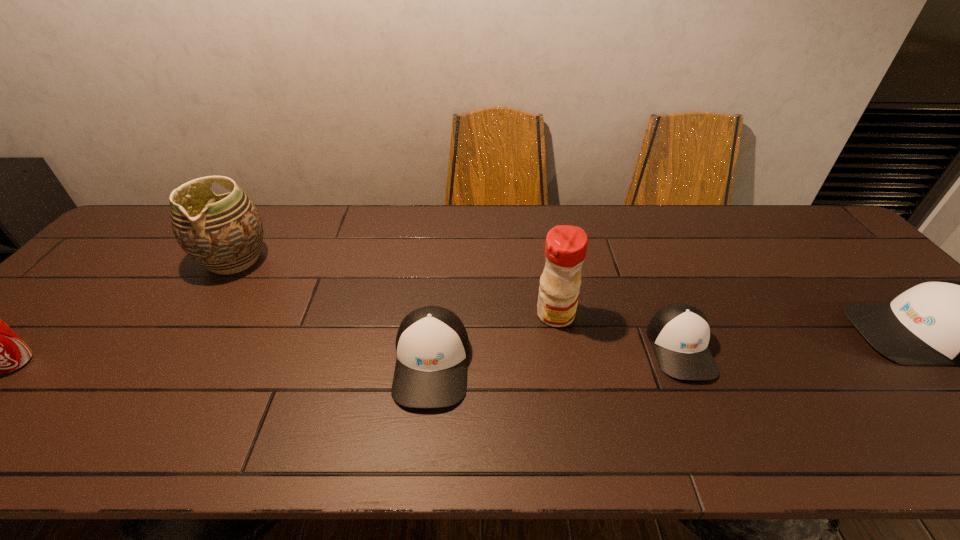
Where is `the fourth object from right to left`? This screenshot has height=540, width=960. the fourth object from right to left is located at coordinates (432, 345).

Where is `the leftmost cap`? The width and height of the screenshot is (960, 540). the leftmost cap is located at coordinates (432, 345).

Locate an element on the screen. This screenshot has height=540, width=960. the fifth object from left to right is located at coordinates (679, 333).

The image size is (960, 540). Find the location of `the shortest object`. the shortest object is located at coordinates (679, 333).

Locate an element on the screen. the farthest object is located at coordinates (223, 233).

The image size is (960, 540). Identify the location of pottery. (223, 233).

You are a GUI agent. You are given a task and a screenshot of the screen. Output one action in this format:
    pyautogui.click(x=<x>, y=<y>)
    Task: Click on the condiment
    The height and width of the screenshot is (540, 960).
    Given the screenshot: What is the action you would take?
    pyautogui.click(x=565, y=249)

You are a GUI agent. You are given a task and a screenshot of the screen. Output one action in this format:
    pyautogui.click(x=<x>, y=<y>)
    Task: Click on the free space located 0.180m on the back of the fifth object from right to left
    The height and width of the screenshot is (540, 960).
    Given the screenshot: What is the action you would take?
    pyautogui.click(x=270, y=206)

Locate an element on the screen. The width and height of the screenshot is (960, 540). free region located on the back of the fourth object from left to right is located at coordinates (540, 226).

You are a GUI agent. You are given a task and a screenshot of the screen. Output one action in this format:
    pyautogui.click(x=<x>, y=<y>)
    Task: Click on the object at the far edge
    Image resolution: width=960 pixels, height=540 pixels.
    Given the screenshot: What is the action you would take?
    pyautogui.click(x=223, y=233)